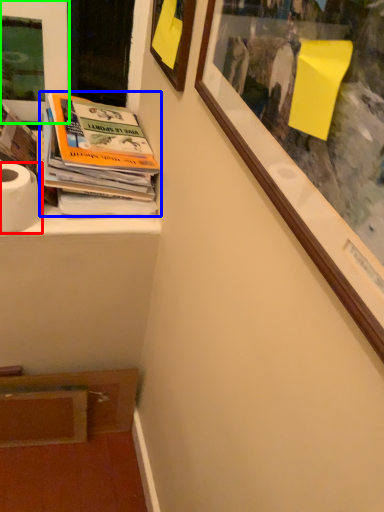
Question: Based on their relative distances, which object is nearer to toilet paper (highlighted by a red box)? Choose from book (highlighted by a blue box) and picture frame (highlighted by a green box).

Choices:
 (A) book
 (B) picture frame

Answer: (A)